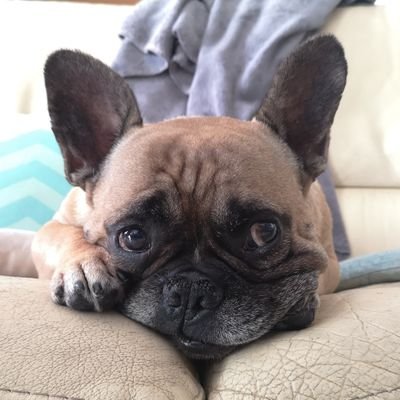
At what (x,y) coordinates should I click in order to perform the action: click on cream sofa cushions. Please return your answer as a coordinate pair (x, y). The width and height of the screenshot is (400, 400). Looking at the image, I should click on (322, 365), (103, 365), (353, 137), (55, 24).